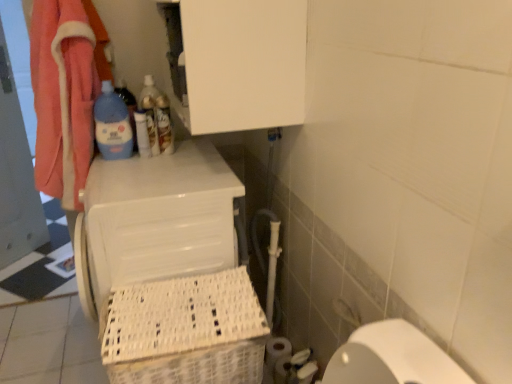
You are a GUI agent. You are given a task and a screenshot of the screen. Output one action in this format:
    pyautogui.click(x=<x>, y=<y>)
    Task: Click on the free location in front of translucent plastic bottle at upper center, positioned as the first bottle in right-to-left order
    This screenshot has height=384, width=512.
    Given the screenshot: What is the action you would take?
    pyautogui.click(x=170, y=160)